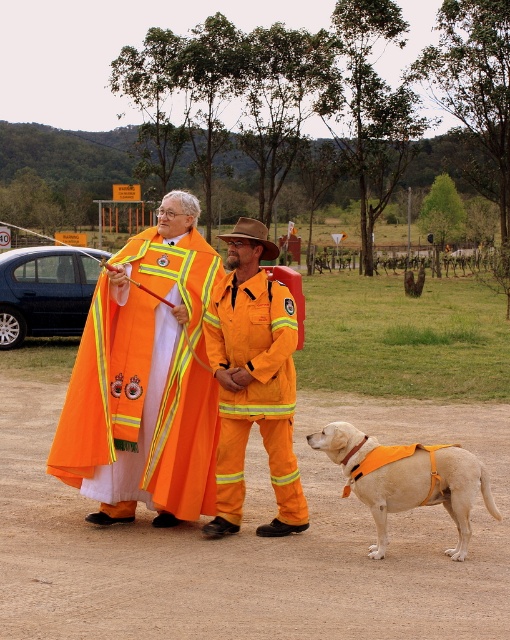
Is the position of high visibility fabric coat at center more distant than that of orange fireproof suit at center?

Yes.

Is high visibility fabric coat at center to the right of orange fireproof suit at center from the viewer's perspective?

Correct, you'll find high visibility fabric coat at center to the right of orange fireproof suit at center.

The image size is (510, 640). I want to click on high visibility fabric coat at center, so click(145, 378).

Which is behind, point (275, 336) or point (475, 472)?

The point (275, 336) is behind.

Can you confirm if orange fireproof suit at center is wider than light brown fabric dog at lower right?

No.

Is point (235, 340) in front of point (452, 509)?

That is False.

This screenshot has height=640, width=510. Find the location of `orange fireproof suit at center`. orange fireproof suit at center is located at coordinates (253, 380).

Is point (164, 440) farther from camera compared to point (324, 445)?

Yes.

Between high visibility fabric coat at center and light brown fabric dog at lower right, which one has less height?

high visibility fabric coat at center

Locate an element on the screen. high visibility fabric coat at center is located at coordinates (145, 378).